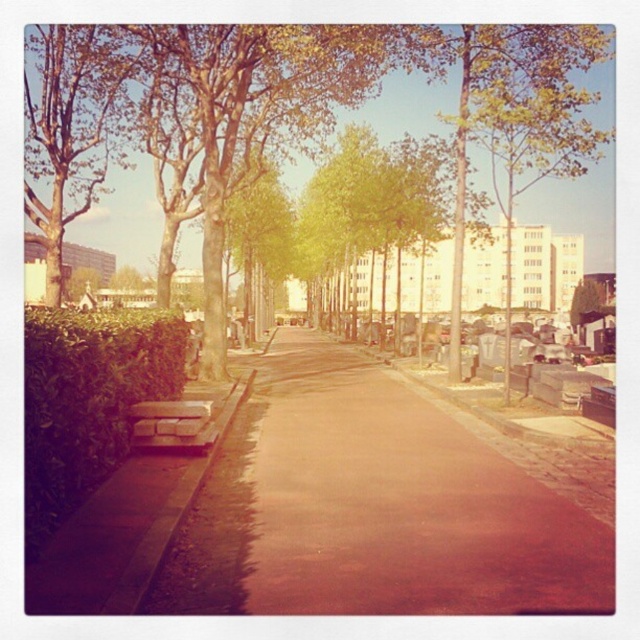
From the picture: Between green leafy tree at center and green leafy hedge at lower left, which one appears on the left side from the viewer's perspective?

green leafy tree at center

Can you confirm if green leafy tree at center is positioned above green leafy hedge at lower left?

Yes.

Describe the element at coordinates (305, 84) in the screenshot. I see `green leafy tree at center` at that location.

Where is `green leafy tree at center`? green leafy tree at center is located at coordinates (305, 84).

Who is shorter, green leafy tree at upper center or wooden park bench at lower left?

wooden park bench at lower left is shorter.

Does green leafy tree at upper center have a larger size compared to wooden park bench at lower left?

Correct, green leafy tree at upper center is larger in size than wooden park bench at lower left.

Is point (541, 90) farther from viewer compared to point (141, 412)?

That is True.

This screenshot has height=640, width=640. What are the coordinates of `green leafy tree at upper center` in the screenshot? It's located at (531, 147).

Between point (51, 532) and point (38, 36), which one is positioned in front?

Point (51, 532) is more forward.

Is green leafy hedge at lower left thinner than green leafy tree at upper left?

Correct, green leafy hedge at lower left's width is less than green leafy tree at upper left's.

Who is more distant from viewer, (172, 390) or (115, 32)?

Point (115, 32)

Locate an element on the screen. The image size is (640, 640). green leafy hedge at lower left is located at coordinates (88, 401).